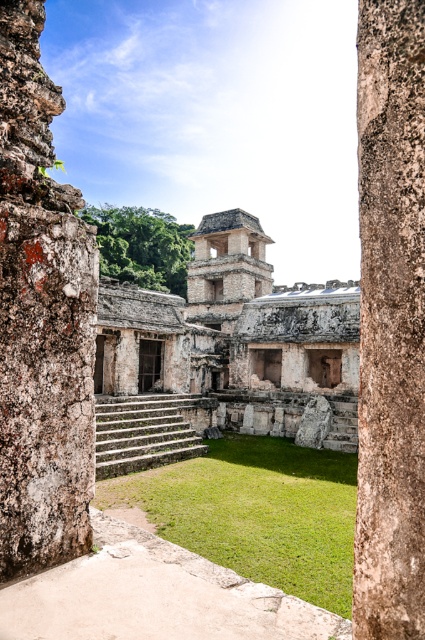
Question: Which object is closer to the camera taking this photo?

Choices:
 (A) white stone ruins at center
 (B) rough stone pillar at center
 (C) rusty stone pillar at left

Answer: (B)

Question: Does white stone ruins at center have a greater width compared to rough stone pillar at center?

Choices:
 (A) no
 (B) yes

Answer: (B)

Question: Observing the image, what is the correct spatial positioning of rusty stone pillar at left in reference to rough stone pillar at center?

Choices:
 (A) above
 (B) below

Answer: (A)

Question: Which of the following is the farthest from the observer?

Choices:
 (A) rusty stone pillar at left
 (B) white stone ruins at center

Answer: (B)

Question: Can you confirm if white stone ruins at center is smaller than rusty stone pillar at left?

Choices:
 (A) no
 (B) yes

Answer: (A)

Question: Which point is closer to the camera?

Choices:
 (A) white stone ruins at center
 (B) rusty stone pillar at left
 (C) rough stone pillar at center

Answer: (C)